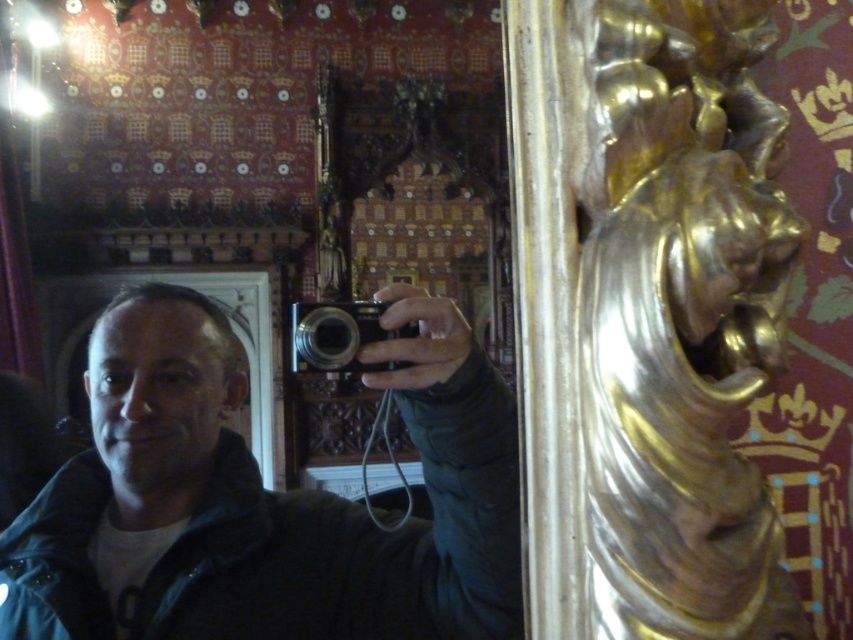
Question: Can you confirm if matte black camera at center is positioned below black plastic camera at center?

Choices:
 (A) yes
 (B) no

Answer: (B)

Question: Which of the following is the closest to the observer?

Choices:
 (A) matte black camera at center
 (B) black plastic camera at center

Answer: (B)

Question: Which object is farther from the camera taking this photo?

Choices:
 (A) matte black camera at center
 (B) black plastic camera at center

Answer: (A)

Question: Does matte black camera at center have a larger size compared to black plastic camera at center?

Choices:
 (A) no
 (B) yes

Answer: (A)

Question: Is the position of matte black camera at center less distant than that of black plastic camera at center?

Choices:
 (A) no
 (B) yes

Answer: (A)

Question: Among these points, which one is nearest to the camera?

Choices:
 (A) (397, 316)
 (B) (404, 330)

Answer: (A)